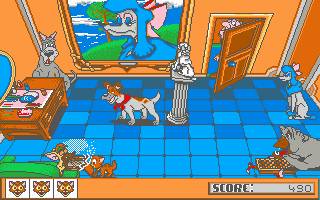
Where is `door`? This screenshot has width=320, height=200. door is located at coordinates (229, 46).